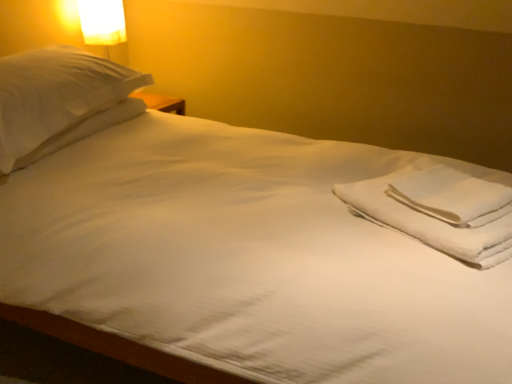
Question: Is matte white lampshade at upper left shorter than white soft towel at right?

Choices:
 (A) yes
 (B) no

Answer: (B)

Question: Is white soft towel at right at the back of matte white lampshade at upper left?

Choices:
 (A) yes
 (B) no

Answer: (B)

Question: Is white soft towel at right inside matte white lampshade at upper left?

Choices:
 (A) yes
 (B) no

Answer: (B)

Question: From a real-world perspective, does matte white lampshade at upper left sit lower than white soft towel at right?

Choices:
 (A) no
 (B) yes

Answer: (A)

Question: Considering the relative positions of matte white lampshade at upper left and white soft towel at right in the image provided, is matte white lampshade at upper left in front of white soft towel at right?

Choices:
 (A) no
 (B) yes

Answer: (A)

Question: From the image's perspective, is white cotton towels at right above or below white soft towel at right?

Choices:
 (A) above
 (B) below

Answer: (B)

Question: Looking at their shapes, would you say white cotton towels at right is wider or thinner than white soft towel at right?

Choices:
 (A) thin
 (B) wide

Answer: (B)

Question: In terms of size, does white cotton towels at right appear bigger or smaller than white soft towel at right?

Choices:
 (A) big
 (B) small

Answer: (A)

Question: In the image, is white cotton towels at right positioned in front of or behind white soft towel at right?

Choices:
 (A) behind
 (B) front

Answer: (B)

Question: Relative to matte white lampshade at upper left, is white soft pillow at upper left in front or behind?

Choices:
 (A) front
 (B) behind

Answer: (A)

Question: Based on their positions, is white soft pillow at upper left located to the left or right of matte white lampshade at upper left?

Choices:
 (A) left
 (B) right

Answer: (B)

Question: Is point (101, 79) closer or farther from the camera than point (106, 33)?

Choices:
 (A) farther
 (B) closer

Answer: (B)

Question: From a real-world perspective, is white soft pillow at upper left physically located above or below matte white lampshade at upper left?

Choices:
 (A) above
 (B) below

Answer: (B)

Question: Is white soft towel at right bigger or smaller than white cotton towels at right?

Choices:
 (A) small
 (B) big

Answer: (A)

Question: Choose the correct answer: Is white soft towel at right inside white cotton towels at right or outside it?

Choices:
 (A) inside
 (B) outside

Answer: (A)